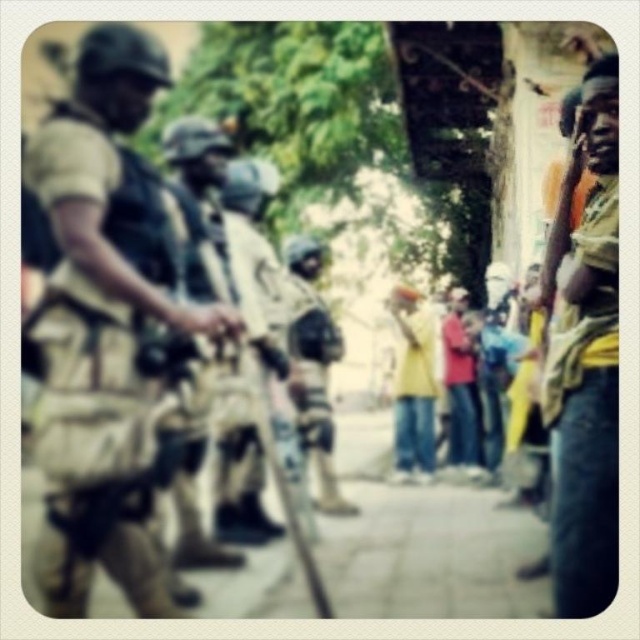
Does point (60, 536) lie behind point (593, 397)?

No, (60, 536) is closer to viewer.

The image size is (640, 640). What do you see at coordinates (104, 323) in the screenshot? I see `tan uniform at left` at bounding box center [104, 323].

Is point (72, 328) in front of point (595, 145)?

Yes, it is.

Find the location of a particular element. The height and width of the screenshot is (640, 640). tan uniform at left is located at coordinates (104, 323).